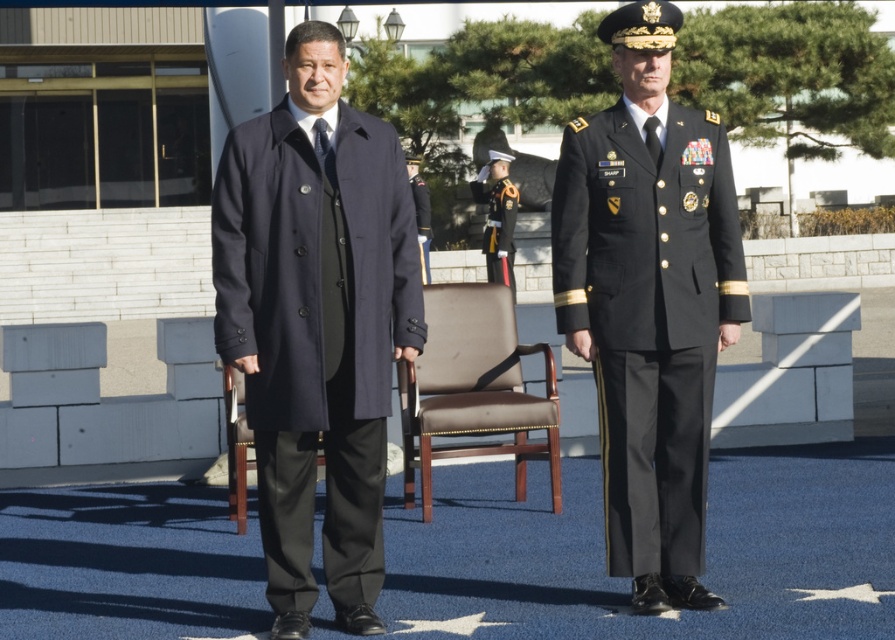
Looking at this image, is black glossy military uniform at center shorter than black glossy uniform at center?

No, black glossy military uniform at center is not shorter than black glossy uniform at center.

Find the location of `black glossy military uniform at center`. black glossy military uniform at center is located at coordinates (649, 316).

Is the position of black leather gloves at center less distant than that of black glossy uniform at center?

No.

This screenshot has width=895, height=640. I want to click on black leather gloves at center, so click(x=499, y=228).

Between point (433, 364) and point (499, 182), which one is positioned behind?

The point (499, 182) is behind.

Find the location of a particular element. The width and height of the screenshot is (895, 640). brown leather chair at center is located at coordinates (474, 388).